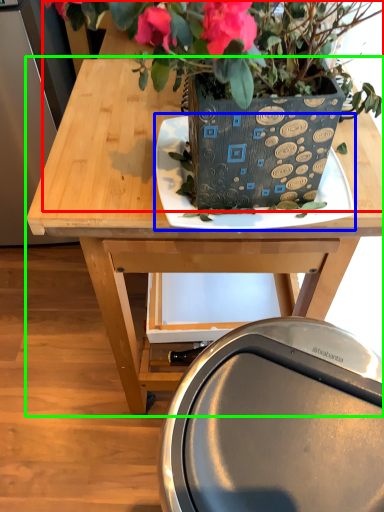
Question: Considering the real-world distances, which object is farthest from houseplant (highlighted by a red box)? plate (highlighted by a blue box) or table (highlighted by a green box)?

Choices:
 (A) plate
 (B) table

Answer: (B)